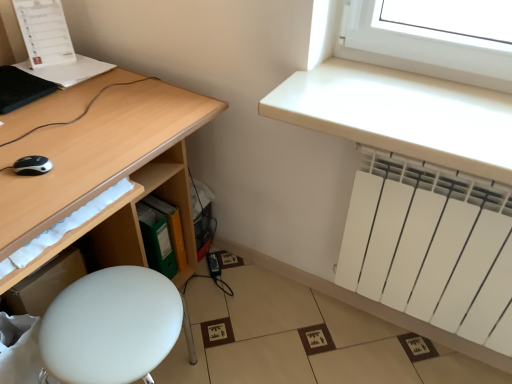
Locate an element on the screen. white matte radiator at upper right is located at coordinates 401,115.

The height and width of the screenshot is (384, 512). Describe the element at coordinates (401, 115) in the screenshot. I see `white matte radiator at upper right` at that location.

You are a GUI agent. You are given a task and a screenshot of the screen. Output one action in this format:
    pyautogui.click(x=<x>, y=<y>)
    Task: Click on the green plastic file at lower center
    The image size is (512, 384).
    Given the screenshot: What is the action you would take?
    pyautogui.click(x=172, y=208)

What do you see at coordinates (113, 327) in the screenshot? I see `white matte stool at lower left` at bounding box center [113, 327].

You are a GUI agent. You are given a task and a screenshot of the screen. Output one action in this format:
    pyautogui.click(x=<x>, y=<y>)
    Task: Click on the black plastic mouse at lower left
    The height and width of the screenshot is (384, 512).
    Given the screenshot: What is the action you would take?
    pyautogui.click(x=32, y=165)

This screenshot has width=512, height=384. I want to click on matte wood desk at left, so click(100, 165).

Based on the photo, from a real-world perspective, is matte wood desk at left physically located above or below white matte radiator at upper right?

Clearly, from a real-world perspective, matte wood desk at left is below white matte radiator at upper right.

Considering the relative sizes of matte wood desk at left and white matte radiator at upper right in the image provided, is matte wood desk at left thinner than white matte radiator at upper right?

Incorrect, the width of matte wood desk at left is not less than that of white matte radiator at upper right.

Does matte wood desk at left turn towards white matte radiator at upper right?

Yes.

Is green plastic file at lower center oriented away from white matte radiator at lower right?

That's not correct — green plastic file at lower center is not looking away from white matte radiator at lower right.

From the picture: Is green plastic file at lower center positioned far away from white matte radiator at lower right?

green plastic file at lower center is near white matte radiator at lower right, not far away.

From the image's perspective, is green plastic file at lower center positioned above or below white matte radiator at lower right?

green plastic file at lower center is situated higher than white matte radiator at lower right in the image.

From a real-world perspective, does green plastic file at lower center sit lower than white matte radiator at lower right?

Indeed, from a real-world perspective, green plastic file at lower center is positioned beneath white matte radiator at lower right.

Between white matte radiator at lower right and white paper at upper left, which one is positioned behind?

white paper at upper left is further from the camera.

From a real-world perspective, is white matte radiator at lower right above or below white paper at upper left?

From a real-world perspective, white matte radiator at lower right is physically below white paper at upper left.

Looking at this image, is white matte radiator at lower right oriented away from white paper at upper left?

No, white matte radiator at lower right's orientation is not away from white paper at upper left.

From the image's perspective, is white matte radiator at lower right located above or below white matte radiator at upper right?

Clearly, from the image's perspective, white matte radiator at lower right is below white matte radiator at upper right.

Considering the relative positions of white matte radiator at lower right and white matte radiator at upper right in the image provided, is white matte radiator at lower right to the left of white matte radiator at upper right from the viewer's perspective?

In fact, white matte radiator at lower right is to the right of white matte radiator at upper right.

Is white matte radiator at lower right directly adjacent to white matte radiator at upper right?

No, white matte radiator at lower right is not in contact with white matte radiator at upper right.

Looking at this image, how many degrees apart are the facing directions of white matte radiator at lower right and white matte radiator at upper right?

There is a 0.0651-degree angle between the facing directions of white matte radiator at lower right and white matte radiator at upper right.

Is white matte radiator at upper right aimed at matte wood desk at left?

No, white matte radiator at upper right is not aimed at matte wood desk at left.

Is white matte radiator at upper right located outside matte wood desk at left?

Indeed, white matte radiator at upper right is completely outside matte wood desk at left.

Looking at this image, between white matte radiator at upper right and matte wood desk at left, which one appears on the left side from the viewer's perspective?

matte wood desk at left is more to the left.

Which of these two, white matte radiator at upper right or matte wood desk at left, is smaller?

white matte radiator at upper right.

Does point (110, 287) lie behind point (177, 255)?

No, (110, 287) is in front of (177, 255).

What's the angular difference between white matte stool at lower left and green plastic file at lower center's facing directions?

The angle between the facing direction of white matte stool at lower left and the facing direction of green plastic file at lower center is 0.719 degrees.

From a real-world perspective, which is physically above, white matte stool at lower left or green plastic file at lower center?

In real-world perspective, white matte stool at lower left is above.

Would you say white matte stool at lower left is outside green plastic file at lower center?

Yes, white matte stool at lower left is not within green plastic file at lower center.

Between matte wood desk at left and white paper at upper left, which one has less height?

white paper at upper left is shorter.

Is matte wood desk at left closer to camera compared to white paper at upper left?

That is True.

Which of these two, matte wood desk at left or white paper at upper left, is smaller?

Smaller between the two is white paper at upper left.

This screenshot has width=512, height=384. What are the coordinates of `desk on the left of the white matte radiator at upper right` in the screenshot? It's located at (100, 165).

Image resolution: width=512 pixels, height=384 pixels. Identify the location of radiator below the green plastic file at lower center (from the image's perspective). (431, 246).

Looking at the image, which one is located further to white paper at upper left, green plastic file at lower center or white matte radiator at upper right?

Among the two, white matte radiator at upper right is located further to white paper at upper left.

Considering their positions, is white matte stool at lower left positioned closer to white paper at upper left than white matte radiator at lower right?

The object closer to white paper at upper left is white matte stool at lower left.

Looking at the image, which one is located closer to matte wood desk at left, black plastic mouse at lower left or white paper at upper left?

Among the two, black plastic mouse at lower left is located nearer to matte wood desk at left.

Which object lies further to the anchor point white paper at upper left, white matte stool at lower left or black plastic mouse at lower left?

Based on the image, white matte stool at lower left appears to be further to white paper at upper left.

When comparing their distances from black plastic mouse at lower left, does white paper at upper left or white matte radiator at lower right seem closer?

white paper at upper left.

Estimate the real-world distances between objects in this image. Which object is further from white matte radiator at upper right, matte wood desk at left or black plastic mouse at lower left?

black plastic mouse at lower left.

When comparing their distances from white matte stool at lower left, does black plastic mouse at lower left or white matte radiator at upper right seem further?

white matte radiator at upper right is positioned further to the anchor white matte stool at lower left.

Considering their positions, is green plastic file at lower center positioned further to matte wood desk at left than white matte radiator at upper right?

white matte radiator at upper right lies further to matte wood desk at left than the other object.

Locate an element on the screen. counter top between black plastic mouse at lower left and white matte radiator at lower right from left to right is located at coordinates (401, 115).

Find the location of a particular element. mouse between white paper at upper left and white matte radiator at lower right from left to right is located at coordinates (32, 165).

The height and width of the screenshot is (384, 512). I want to click on computer between matte wood desk at left and green plastic file at lower center in the front-back direction, so click(x=52, y=45).

This screenshot has width=512, height=384. Identify the location of desk between white paper at upper left and white matte stool at lower left in the vertical direction. (100, 165).